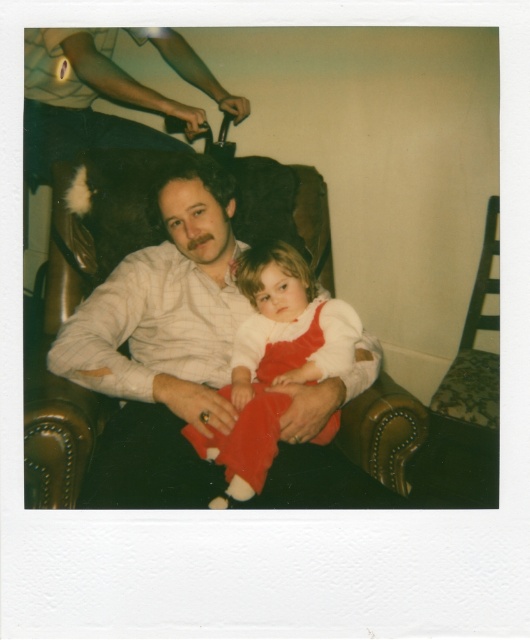
Between matte white shirt at center and velvet red dress at center, which one is positioned lower?

velvet red dress at center is below.

The height and width of the screenshot is (640, 530). Identify the location of matte white shirt at center. (163, 330).

Identify the location of matte white shirt at center. The image size is (530, 640). (163, 330).

I want to click on matte white shirt at center, so click(163, 330).

Who is higher up, matte white shirt at center or matte brown leather chair at upper left?

matte brown leather chair at upper left

Who is positioned more to the left, matte white shirt at center or matte brown leather chair at upper left?

matte brown leather chair at upper left

Between point (107, 358) and point (161, 33), which one is positioned in front?

Point (107, 358) is in front.

You are a GUI agent. You are given a task and a screenshot of the screen. Output one action in this format:
    pyautogui.click(x=<x>, y=<y>)
    Task: Click on the matte white shirt at center
    The height and width of the screenshot is (640, 530).
    Given the screenshot: What is the action you would take?
    pyautogui.click(x=163, y=330)

Is velvet red dress at center wider than matte brown leather chair at upper left?

No, velvet red dress at center is not wider than matte brown leather chair at upper left.

Is point (331, 301) more distant than point (75, 150)?

That is False.

Which is in front, point (251, 461) or point (42, 132)?

Point (251, 461) is more forward.

Find the location of a particular element. velvet red dress at center is located at coordinates (275, 358).